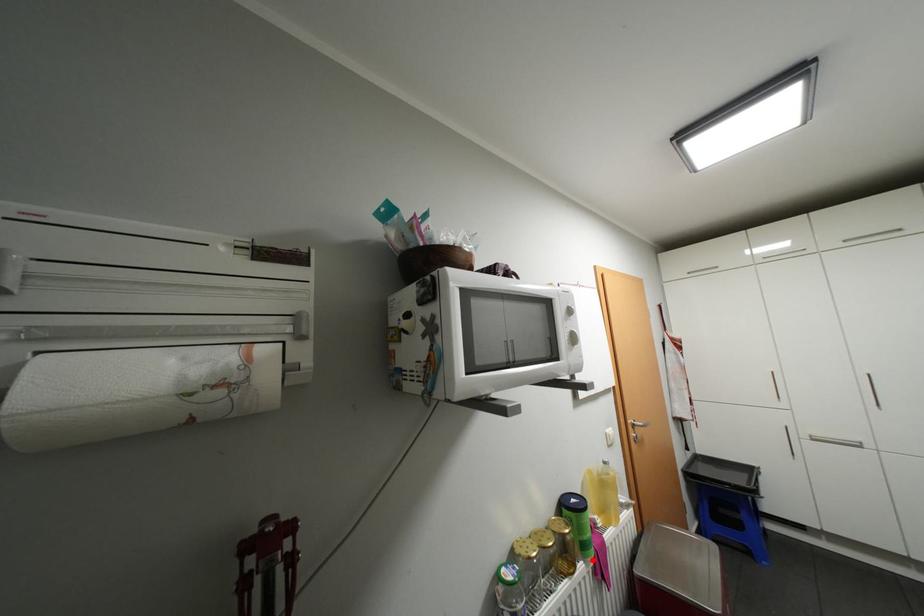
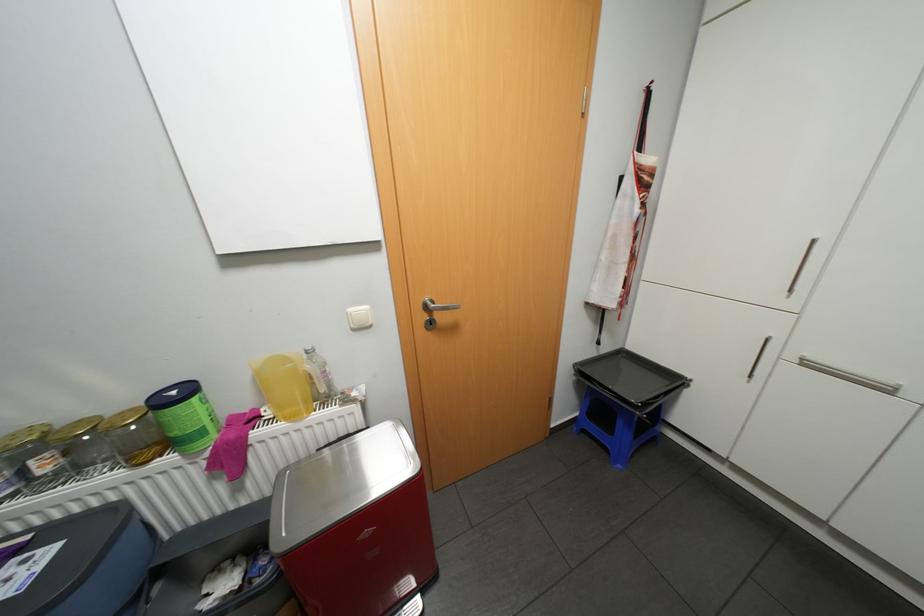
Where in the second image is the point corresponding to the highlighted location from the first image?

(190, 453)